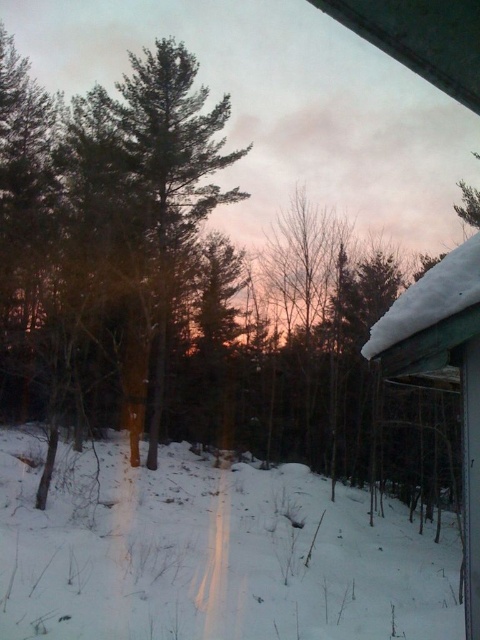
Does white fluffy snow at center appear on the right side of snow-covered wood hut at right?

No, white fluffy snow at center is not to the right of snow-covered wood hut at right.

Measure the distance between white fluffy snow at center and camera.

A distance of 6.23 meters exists between white fluffy snow at center and camera.

The image size is (480, 640). Describe the element at coordinates (211, 554) in the screenshot. I see `white fluffy snow at center` at that location.

This screenshot has width=480, height=640. Find the location of `white fluffy snow at center`. white fluffy snow at center is located at coordinates (211, 554).